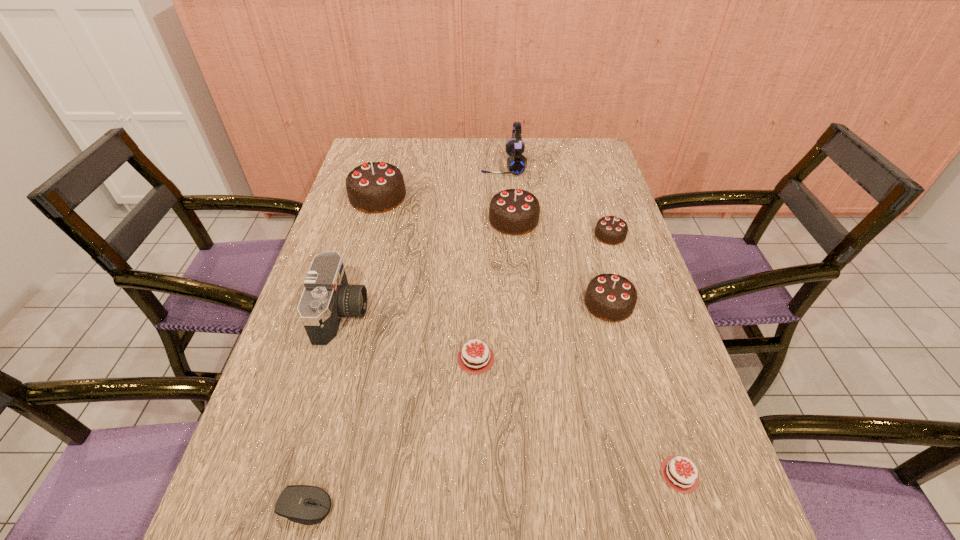
You are a GUI agent. You are given a task and a screenshot of the screen. Output one action in this format:
    pyautogui.click(x=<x>, y=<y>)
    Task: Click on the free spot between the tallest chocolate cake and the biggest red chocolate cake
    The image size is (960, 540).
    Given the screenshot: What is the action you would take?
    pyautogui.click(x=427, y=278)

Identify which object is located as the third nearest to the third smallest chocolate chocolate cake. Please provide its 2D coordinates. Your answer should be formatted as a tuple, i.e. [(x, y)], where the tuple contains the x and y coordinates of a point satisfying the conditions above.

[(610, 297)]

Point out which object is positioned as the nearest to the third shortest chocolate cake. Please provide its 2D coordinates. Your answer should be formatted as a tuple, i.e. [(x, y)], where the tuple contains the x and y coordinates of a point satisfying the conditions above.

[(327, 297)]

Locate which chocolate cake is the third closest to the sixth farthest chocolate cake. Please provide its 2D coordinates. Your answer should be formatted as a tuple, i.e. [(x, y)], where the tuple contains the x and y coordinates of a point satisfying the conditions above.

[(610, 297)]

Select which chocolate cake appears as the second closest to the farthest object. Please provide its 2D coordinates. Your answer should be formatted as a tuple, i.e. [(x, y)], where the tuple contains the x and y coordinates of a point satisfying the conditions above.

[(375, 187)]

Find the location of a particular element. chocolate chocolate cake that stands as the second closest to the sixth tallest chocolate cake is located at coordinates (611, 230).

Find the location of `chocolate chocolate cake that stands as the third closest to the sixth shortest chocolate cake`. chocolate chocolate cake that stands as the third closest to the sixth shortest chocolate cake is located at coordinates (375, 187).

Where is `red chocolate cake that can be found as the second closest to the black camera`? The height and width of the screenshot is (540, 960). red chocolate cake that can be found as the second closest to the black camera is located at coordinates (443, 539).

Find the location of a particular element. This screenshot has height=540, width=960. red chocolate cake that is the closest to the black camera is located at coordinates point(475,360).

The height and width of the screenshot is (540, 960). I want to click on free spot that satisfies the following two spatial constraints: 1. on the front side of the leftmost chocolate chocolate cake; 2. on the front-facing side of the camera, so click(345, 314).